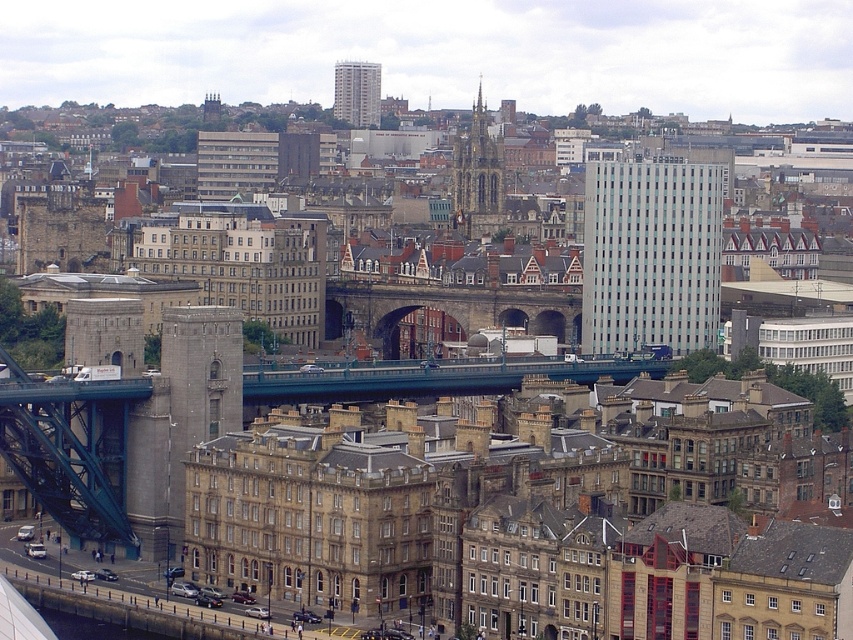
Question: Does brown stone bridge at center have a lesser width compared to dark gray stone tower at center?

Choices:
 (A) no
 (B) yes

Answer: (A)

Question: Which of these objects is positioned closest to the gray concrete building at center right?

Choices:
 (A) light gray concrete building at upper center
 (B) dark gray stone tower at center

Answer: (B)

Question: Which point is farther to the camera?

Choices:
 (A) gray concrete building at center right
 (B) dark gray stone tower at center
 (C) light gray concrete building at upper center
 (D) brown stone bridge at center

Answer: (C)

Question: Which of these objects is positioned closest to the dark gray stone tower at center?

Choices:
 (A) brown stone bridge at center
 (B) blue metallic bridge at center
 (C) gray concrete building at center right

Answer: (A)

Question: Can you confirm if brown stone bridge at center is positioned to the right of dark gray stone tower at center?

Choices:
 (A) no
 (B) yes

Answer: (A)

Question: Where is blue metallic bridge at center located in relation to dark gray stone tower at center in the image?

Choices:
 (A) right
 (B) left

Answer: (B)